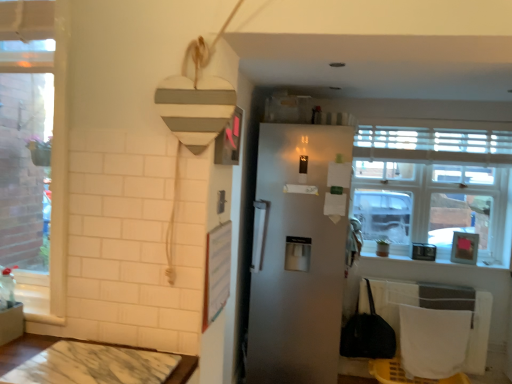
Where is `satin white fridge at center`? The height and width of the screenshot is (384, 512). satin white fridge at center is located at coordinates (296, 257).

This screenshot has height=384, width=512. Identify the location of clear glass window at upper right. (433, 187).

Where is `satin white fridge at center`? The width and height of the screenshot is (512, 384). satin white fridge at center is located at coordinates (296, 257).

Considering the sizes of objects satin white fridge at center and clear glass window at upper right in the image provided, who is taller, satin white fridge at center or clear glass window at upper right?

With more height is satin white fridge at center.

Does satin white fridge at center touch clear glass window at upper right?

No, satin white fridge at center is not next to clear glass window at upper right.

Is satin white fridge at center positioned with its back to clear glass window at upper right?

No, satin white fridge at center is not facing away from clear glass window at upper right.

Is clear glass window at upper right looking in the opposite direction of marble table at lower left?

No, marble table at lower left is not at the back of clear glass window at upper right.

Considering the points (460, 162) and (61, 356), which point is in front, point (460, 162) or point (61, 356)?

The point (61, 356) is more forward.

Which object is positioned more to the left, clear glass window at upper right or marble table at lower left?

marble table at lower left is more to the left.

Is clear glass window at upper right next to marble table at lower left?

No, clear glass window at upper right is not with marble table at lower left.

Could satin white fridge at center be considered to be inside clear glass window at upper right?

That's incorrect, satin white fridge at center is not inside clear glass window at upper right.

What's the angular difference between clear glass window at upper right and satin white fridge at center's facing directions?

87.2 degrees separate the facing orientations of clear glass window at upper right and satin white fridge at center.

Is clear glass window at upper right with satin white fridge at center?

clear glass window at upper right is not next to satin white fridge at center, and they're not touching.

From the image's perspective, which object appears higher, satin white fridge at center or marble table at lower left?

satin white fridge at center appears higher in the image.

From a real-world perspective, is satin white fridge at center physically below marble table at lower left?

No, from a real-world perspective, satin white fridge at center is not under marble table at lower left.

What's the angular difference between satin white fridge at center and marble table at lower left's facing directions?

There is a 88.7-degree angle between the facing directions of satin white fridge at center and marble table at lower left.

Is satin white fridge at center taller than marble table at lower left?

Yes, satin white fridge at center is taller than marble table at lower left.

Measure the distance between marble table at lower left and satin white fridge at center.

marble table at lower left is 1.39 meters away from satin white fridge at center.

Can you confirm if marble table at lower left is positioned to the right of satin white fridge at center?

Incorrect, marble table at lower left is not on the right side of satin white fridge at center.

Does marble table at lower left have a larger size compared to satin white fridge at center?

No.

The width and height of the screenshot is (512, 384). Identify the location of table in front of the satin white fridge at center. (87, 363).

From the image's perspective, is marble table at lower left above clear glass window at upper right?

No, from the image's perspective, marble table at lower left is not above clear glass window at upper right.

Which of these two, marble table at lower left or clear glass window at upper right, is bigger?

clear glass window at upper right is bigger.

Find the location of a particular element. The height and width of the screenshot is (384, 512). window on the right of the marble table at lower left is located at coordinates (433, 187).

Image resolution: width=512 pixels, height=384 pixels. Find the location of `refrigerator on the left of clear glass window at upper right`. refrigerator on the left of clear glass window at upper right is located at coordinates (296, 257).

Where is `window above the marble table at lower left (from the image's perspective)`? window above the marble table at lower left (from the image's perspective) is located at coordinates (433, 187).

Which object lies nearer to the anchor point marble table at lower left, satin white fridge at center or clear glass window at upper right?

The object closer to marble table at lower left is satin white fridge at center.

When comparing their distances from satin white fridge at center, does marble table at lower left or clear glass window at upper right seem further?

The object further to satin white fridge at center is marble table at lower left.

Which object lies further to the anchor point satin white fridge at center, clear glass window at upper right or marble table at lower left?

The object further to satin white fridge at center is marble table at lower left.

Considering their positions, is marble table at lower left positioned closer to clear glass window at upper right than satin white fridge at center?

satin white fridge at center is closer to clear glass window at upper right.

When comparing their distances from marble table at lower left, does clear glass window at upper right or satin white fridge at center seem further?

clear glass window at upper right is positioned further to the anchor marble table at lower left.

Which object lies further to the anchor point clear glass window at upper right, satin white fridge at center or marble table at lower left?

marble table at lower left.

In order to click on refrigerator positioned between marble table at lower left and clear glass window at upper right from near to far in this screenshot , I will do `click(296, 257)`.